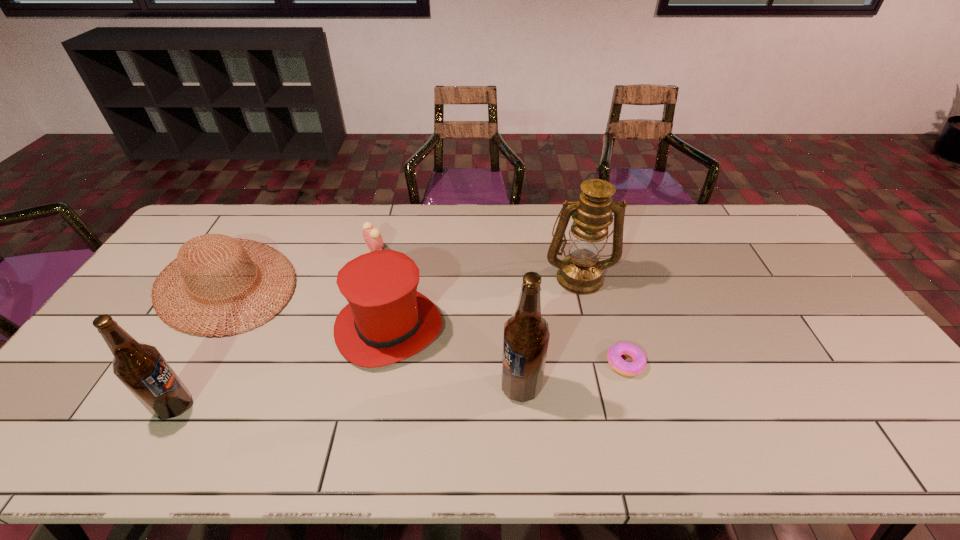
In the current image, all beer bottles are evenly spaced. To maintain this equal spacing, where should an additional beer bottle be placed on the right? Please point out a free spot. Please provide its 2D coordinates. Your answer should be formatted as a tuple, i.e. [(x, y)], where the tuple contains the x and y coordinates of a point satisfying the conditions above.

[(844, 370)]